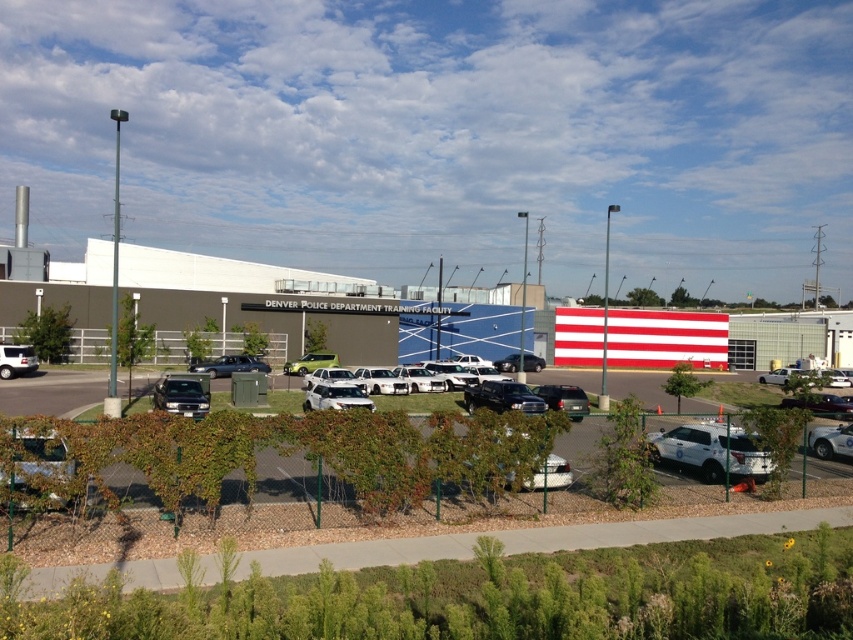
Question: Which point is closer to the camera taking this photo?

Choices:
 (A) (824, 403)
 (B) (323, 358)
 (C) (347, 404)

Answer: (C)

Question: Observing the image, what is the correct spatial positioning of matte black suv at center-left in reference to metallic gray sedan at center?

Choices:
 (A) below
 (B) above

Answer: (A)

Question: Estimate the real-world distances between objects in this image. Which object is closer to the matte silver suv at lower left?

Choices:
 (A) white glossy police car at center
 (B) metallic gray sedan at center
 (C) matte black suv at center-left
 (D) metallic silver sedan at lower right

Answer: (B)

Question: Is the position of white matte sedan at center less distant than that of white glossy sedan at center?

Choices:
 (A) yes
 (B) no

Answer: (A)

Question: Can you confirm if black matte truck at center is thinner than shiny black sedan at center?

Choices:
 (A) no
 (B) yes

Answer: (B)

Question: Among these objects, which one is nearest to the camera?

Choices:
 (A) metallic gray sedan at center
 (B) shiny black sedan at center

Answer: (B)